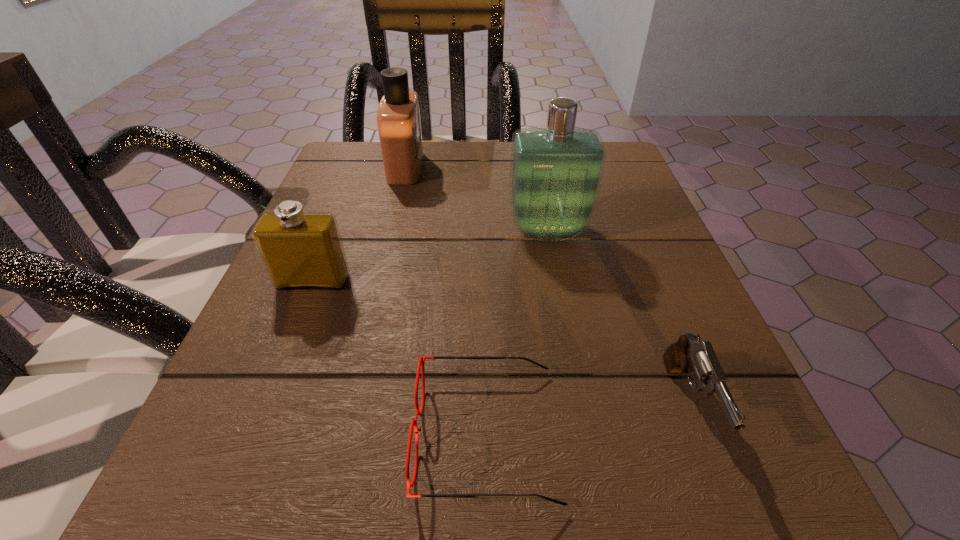
Locate an element on the screen. This screenshot has height=540, width=960. vacant region located on the front label of the second perfume from left to right is located at coordinates (468, 168).

You are a GUI agent. You are given a task and a screenshot of the screen. Output one action in this format:
    pyautogui.click(x=<x>, y=<y>)
    Task: Click on the blank space located on the front-facing side of the third shortest object
    The height and width of the screenshot is (540, 960).
    Given the screenshot: What is the action you would take?
    pyautogui.click(x=300, y=316)

You are a GUI agent. You are given a task and a screenshot of the screen. Output one action in this format:
    pyautogui.click(x=<x>, y=<y>)
    Task: Click on the free space located 0.130m on the front-facing side of the shortest object
    The width and height of the screenshot is (960, 540).
    Given the screenshot: What is the action you would take?
    pyautogui.click(x=307, y=434)

Identify the location of vacant space located on the front-facing side of the shortest object. The width and height of the screenshot is (960, 540). (282, 434).

What are the coordinates of `free spot located on the front-facing side of the shortest object` in the screenshot? It's located at (299, 434).

Where is `object present at the far edge`? The height and width of the screenshot is (540, 960). object present at the far edge is located at coordinates (398, 115).

Locate an element on the screen. The width and height of the screenshot is (960, 540). pistol at the near edge is located at coordinates (689, 354).

Where is `spectacles that is at the near edge`? This screenshot has height=540, width=960. spectacles that is at the near edge is located at coordinates (421, 361).

Find the location of a particular element. The width and height of the screenshot is (960, 540). perfume that is at the right edge is located at coordinates (555, 176).

Where is `pistol that is at the right edge`? The height and width of the screenshot is (540, 960). pistol that is at the right edge is located at coordinates (689, 354).